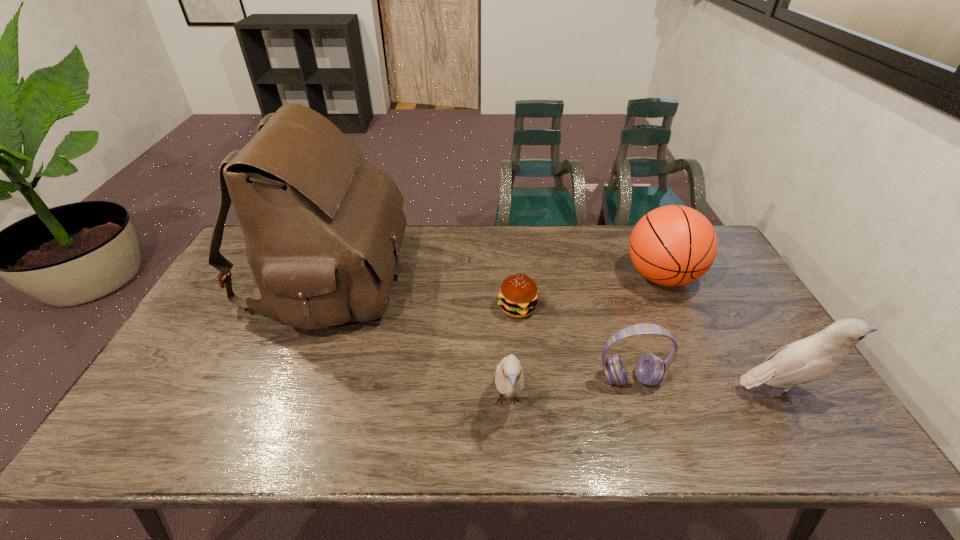
I want to click on free spot between the taller bird and the shortest object, so click(649, 349).

Where is `vacant space that is in between the satchel and the basketball`? The image size is (960, 540). vacant space that is in between the satchel and the basketball is located at coordinates (493, 277).

Locate which object ranks fourth in proximity to the headset. Please provide its 2D coordinates. Your answer should be formatted as a tuple, i.e. [(x, y)], where the tuple contains the x and y coordinates of a point satisfying the conditions above.

[(674, 245)]

Locate an element on the screen. object that is the closest to the basketball is located at coordinates pos(650,369).

The width and height of the screenshot is (960, 540). In order to click on vacant space that satisfies the following two spatial constraints: 1. on the front flap of the tallest object; 2. on the right side of the shortest object in this screenshot , I will do `click(314, 308)`.